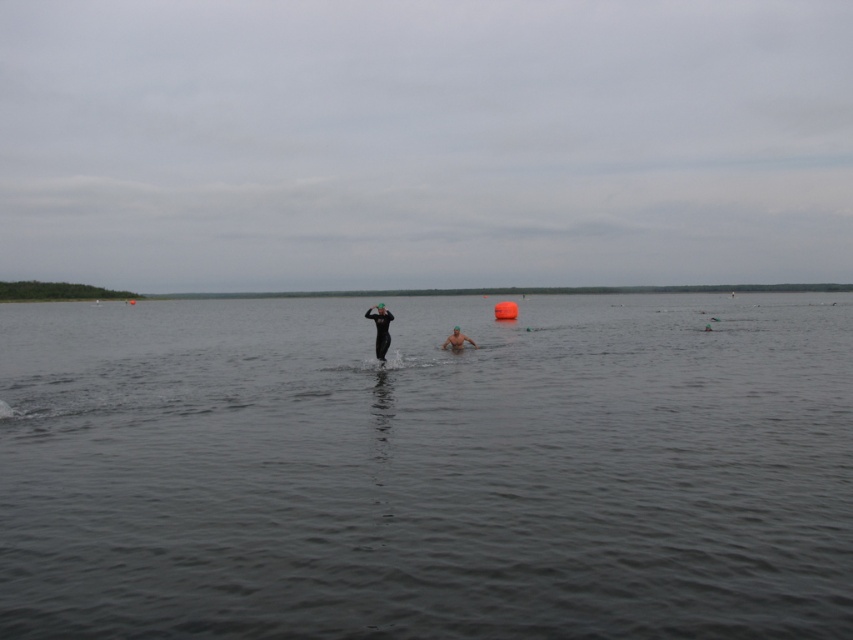
Question: Which of these objects is positioned farthest from the dark gray water at center?

Choices:
 (A) black matte wetsuit at center
 (B) smooth skin person at center

Answer: (A)

Question: In this image, where is black matte wetsuit at center located relative to smooth skin person at center?

Choices:
 (A) left
 (B) right

Answer: (A)

Question: Among these points, which one is farthest from the camera?

Choices:
 (A) (440, 436)
 (B) (375, 340)
 (C) (469, 337)

Answer: (C)

Question: Can you confirm if dark gray water at center is thinner than black matte wetsuit at center?

Choices:
 (A) no
 (B) yes

Answer: (A)

Question: Is black matte wetsuit at center to the right of smooth skin person at center from the viewer's perspective?

Choices:
 (A) no
 (B) yes

Answer: (A)

Question: Estimate the real-world distances between objects in this image. Which object is farther from the dark gray water at center?

Choices:
 (A) smooth skin person at center
 (B) black matte wetsuit at center

Answer: (B)